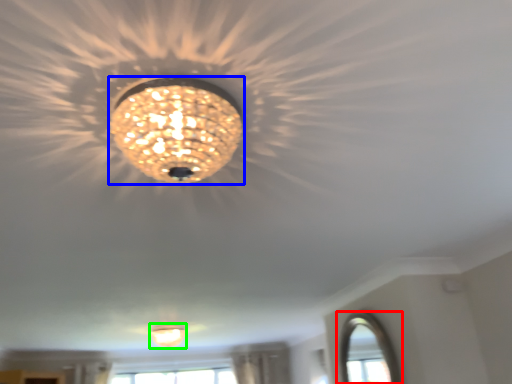
Question: Considering the real-world distances, which object is closest to window (highlighted by a red box)? lamp (highlighted by a blue box) or lamp (highlighted by a green box).

Choices:
 (A) lamp
 (B) lamp

Answer: (B)